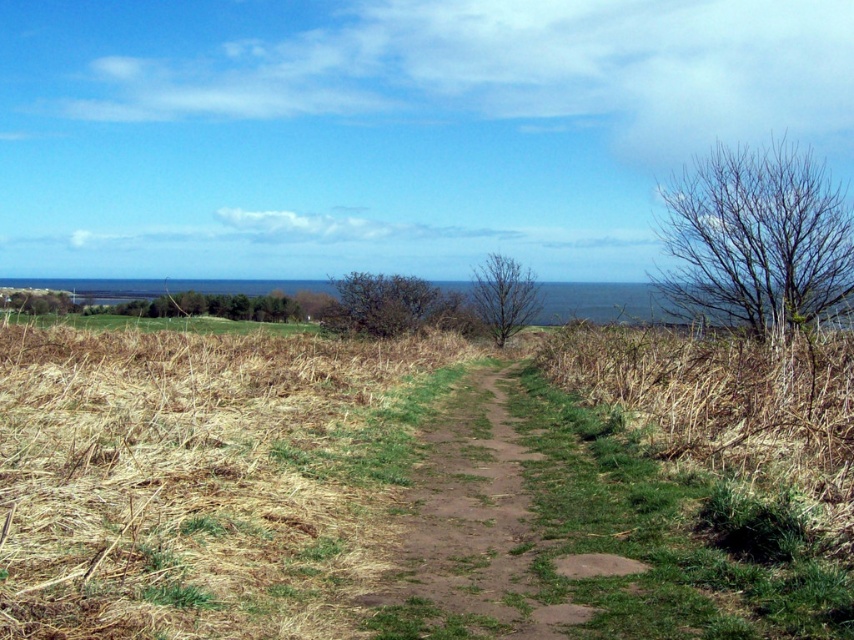
You are standing at the start of the dirt path in the coastal landscape. You see a point marked at coordinates (x=756, y=241). What does this point indicate in the scene?

The point at (x=756, y=241) marks the location of the bare branches at upper right in the scene.

Looking at this image, you are planning to take a photo of the dirt path at center and the green leafy tree at upper left. Which object appears taller in the image?

The green leafy tree at upper left is taller than the dirt path at center.

You are planning to take a photo of the dirt path at center and the green leafy tree at upper left. Which object should you focus on first if you want to capture both in a single frame without moving the camera?

The dirt path at center is smaller than the green leafy tree at upper left, so you should focus on the dirt path at center first to ensure it is in sharp focus while the larger tree may remain in focus due to its size and position.